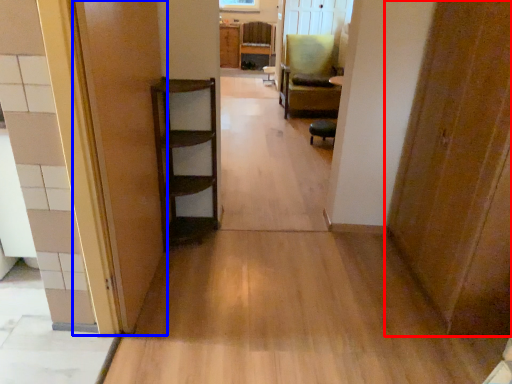
Question: Among these objects, which one is farthest to the camera, door (highlighted by a red box) or door (highlighted by a blue box)?

Choices:
 (A) door
 (B) door

Answer: (A)